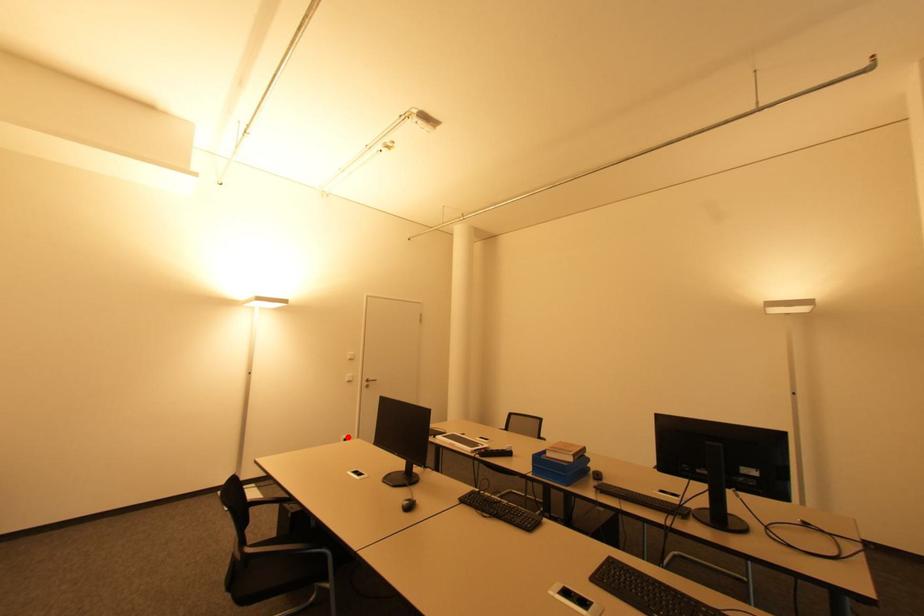
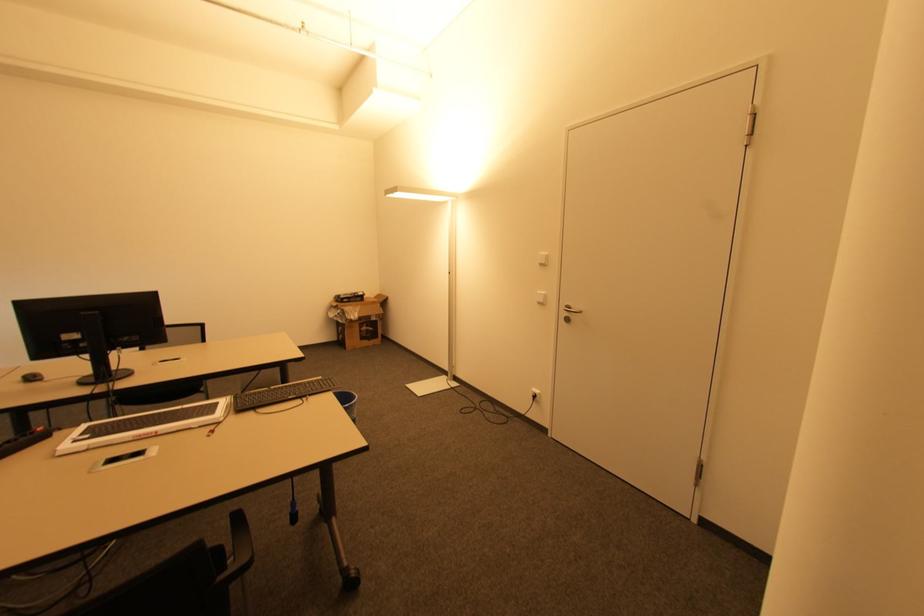
Question: A red point is marked in image1. In image2, is the corresponding 3D point closer to the camera or farther? Reply with the corresponding letter.

Choices:
 (A) The corresponding 3D point is closer.
 (B) The corresponding 3D point is farther.

Answer: (A)